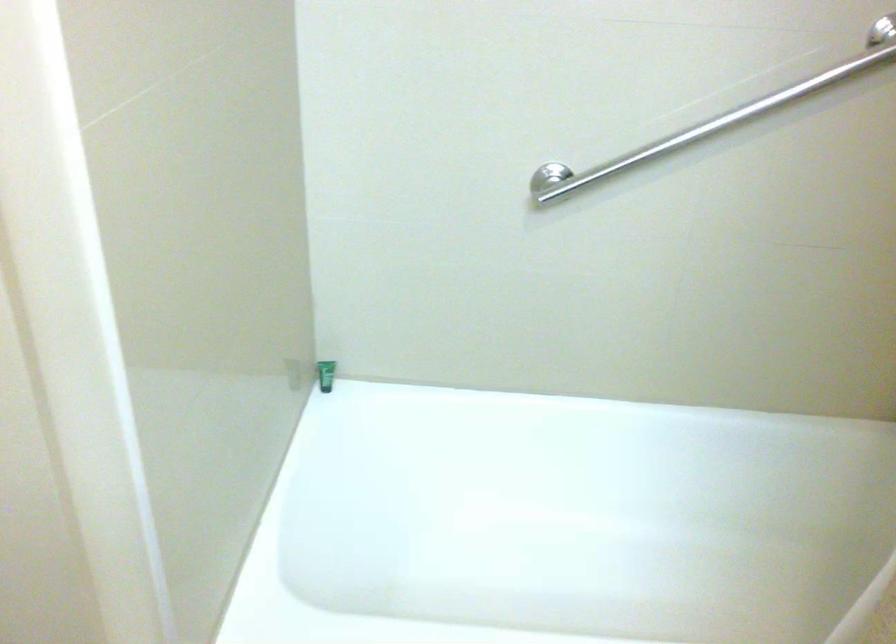
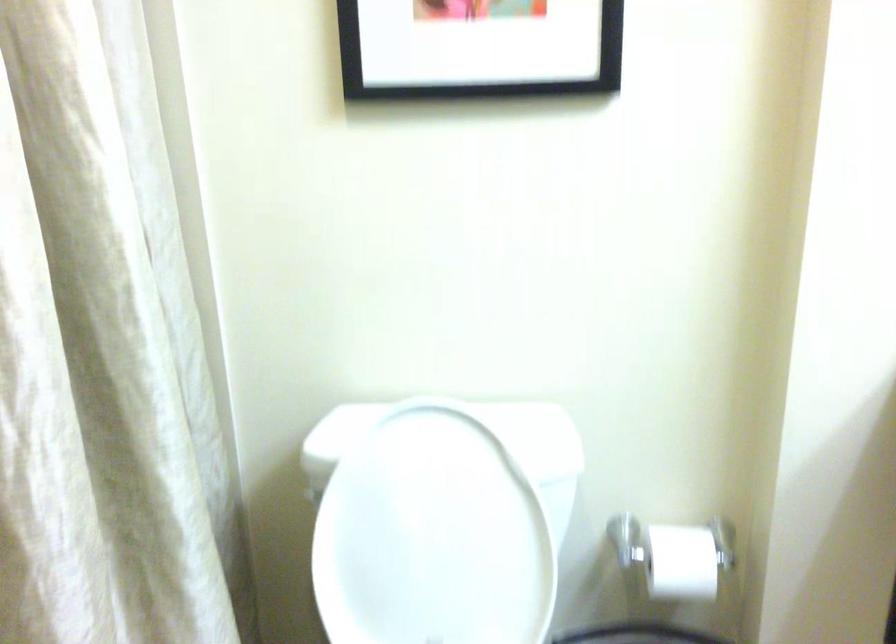
The images are taken continuously from a first-person perspective. In which direction is your viewpoint rotating?

The camera's rotation is toward right-down.